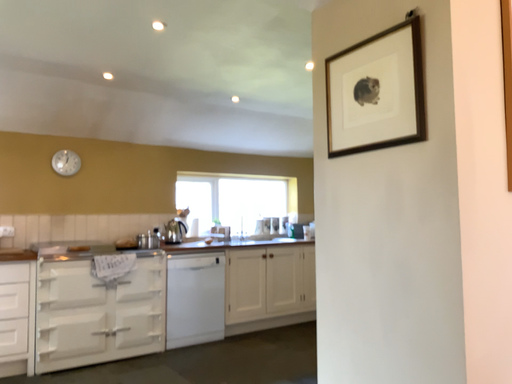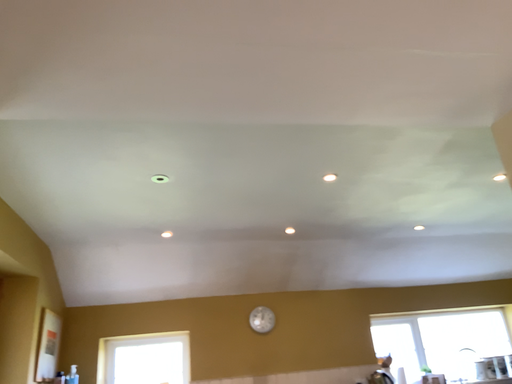
Question: Which way did the camera rotate in the video?

Choices:
 (A) rotated downward
 (B) rotated upward

Answer: (B)